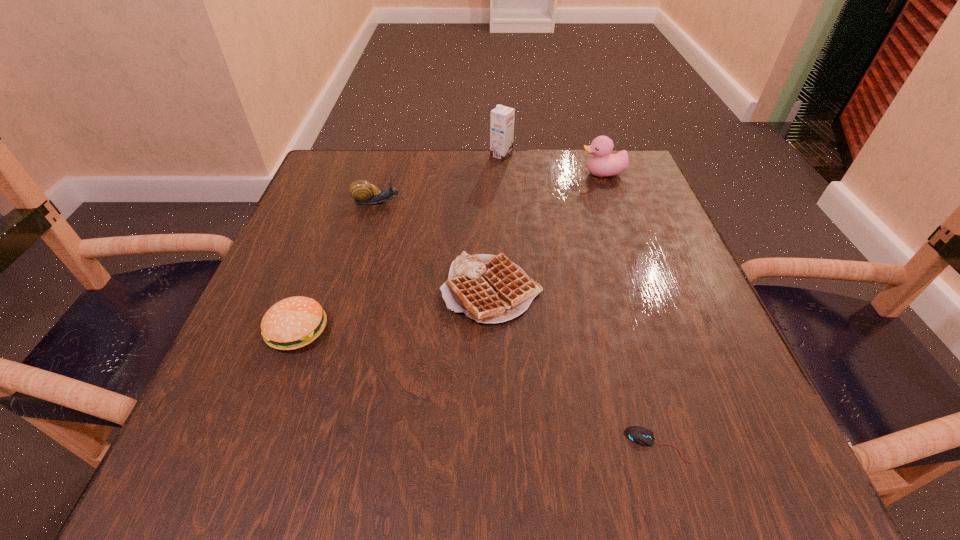
Find the location of `the farthest object`. the farthest object is located at coordinates (502, 118).

Locate an element on the screen. The width and height of the screenshot is (960, 540). the tallest object is located at coordinates (502, 118).

I want to click on the second tallest object, so coord(603,164).

Where is `the second farthest object`? the second farthest object is located at coordinates (603, 164).

Where is `the third farthest object`? The height and width of the screenshot is (540, 960). the third farthest object is located at coordinates (363, 192).

Find the location of a particular element. The height and width of the screenshot is (540, 960). escargot is located at coordinates (363, 192).

At what (x,y) coordinates should I click in order to perform the action: click on the fourth tallest object. Please return your answer as a coordinate pair (x, y). This screenshot has width=960, height=540. Looking at the image, I should click on (292, 323).

Where is `waffle`? Image resolution: width=960 pixels, height=540 pixels. waffle is located at coordinates (489, 289).

Identify the location of mouse. (640, 435).

Find the location of `the shortest object`. the shortest object is located at coordinates (640, 435).